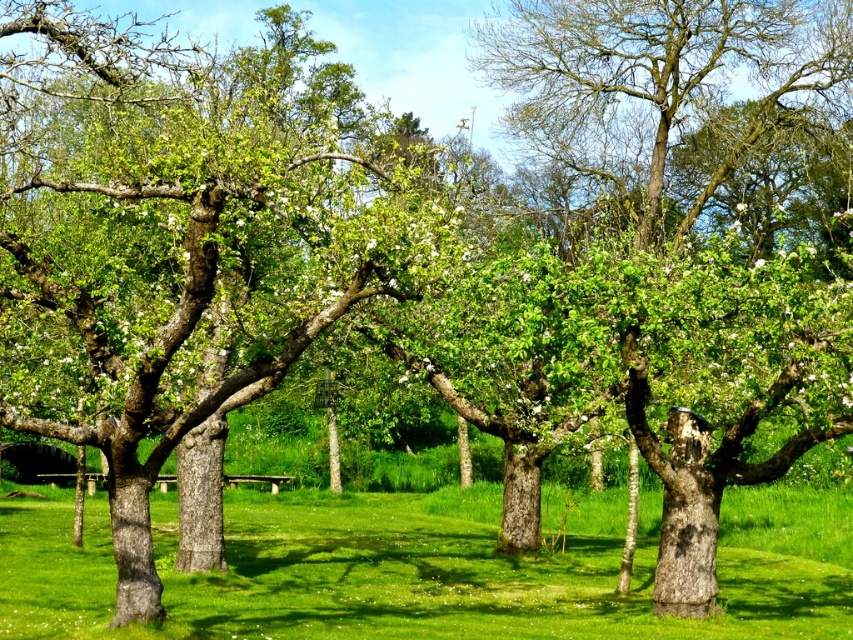
Question: Is green rough bark tree at center below green grass at center?

Choices:
 (A) no
 (B) yes

Answer: (A)

Question: Is green rough bark tree at center smaller than green grass at center?

Choices:
 (A) yes
 (B) no

Answer: (B)

Question: Which of the following is the farthest from the observer?

Choices:
 (A) green grass at center
 (B) green rough bark tree at center

Answer: (A)

Question: Does green rough bark tree at center lie in front of green grass at center?

Choices:
 (A) no
 (B) yes

Answer: (B)